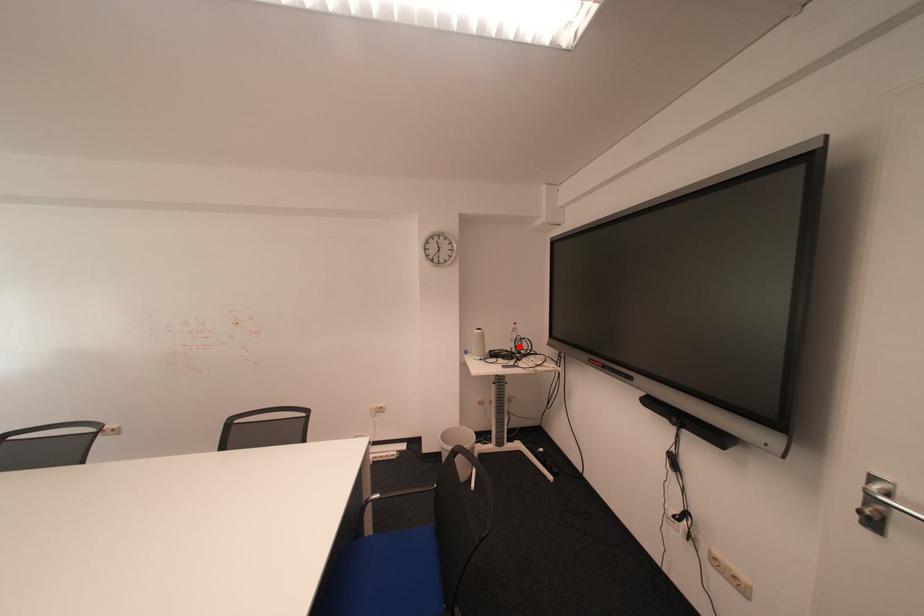
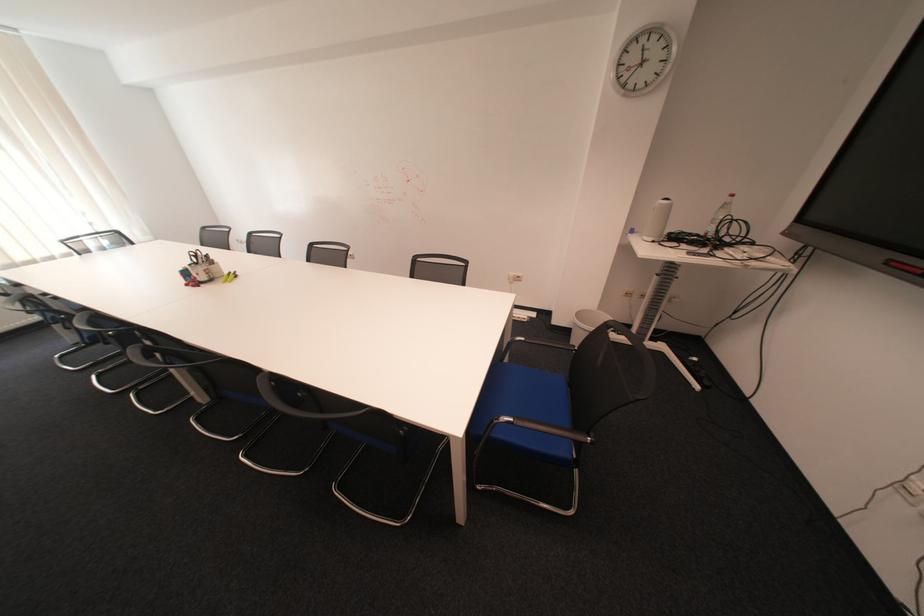
Locate, in the second image, the point that corresponds to the highlighted location in the first image.

(714, 229)